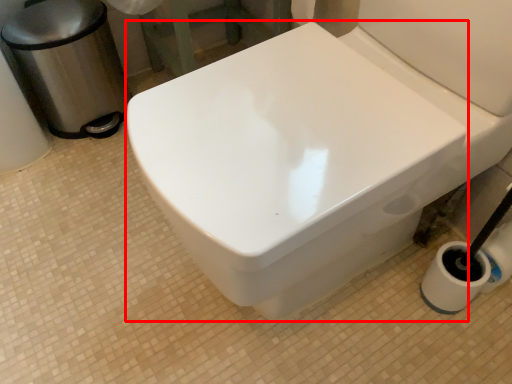
Question: Where is bidet (annotated by the red box) located in relation to garbage in the image?

Choices:
 (A) left
 (B) right

Answer: (B)